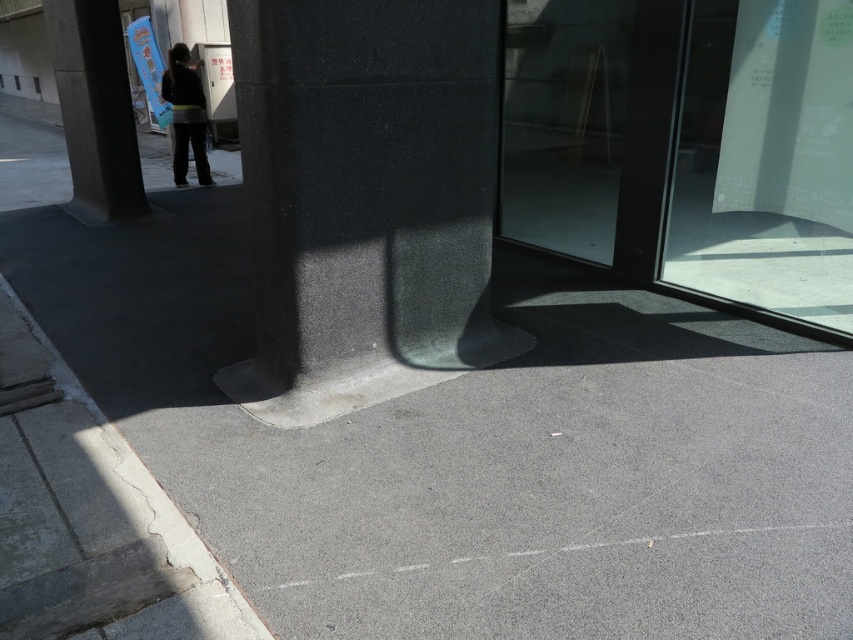
You are a delivery person trying to determine if your 1.8m tall package can fit through the transparent glass door at right and over the gray concrete curb at lower left. Based on their heights, which object will pose a height restriction issue?

The transparent glass door at right has a lesser height compared to the gray concrete curb at lower left. Since the package is 1.8m tall, the transparent glass door at right is shorter and would pose a height restriction issue.